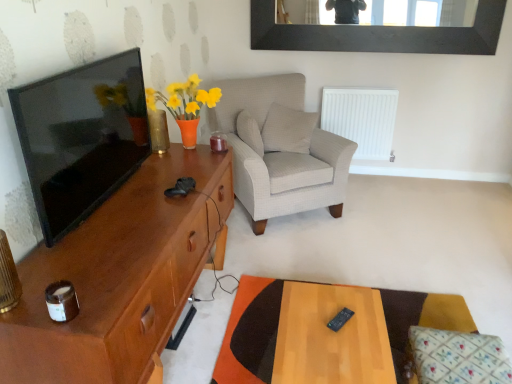
Identify the location of unoccupied area in front of black plastic remote at center. (349, 352).